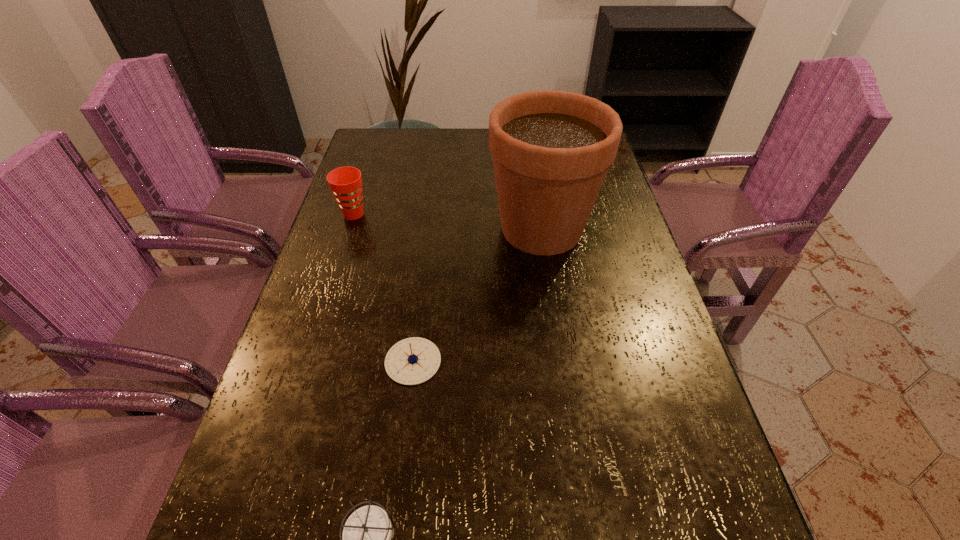
The image size is (960, 540). I want to click on vacant space at the far edge, so click(x=449, y=137).

In the image, there is a desktop. Identify the location of vacant space at the left edge. This screenshot has width=960, height=540. (399, 186).

Identify the location of vacant space at the right edge of the desktop. (618, 339).

This screenshot has width=960, height=540. Identify the location of vacant position at the far left corner of the desktop. (365, 150).

This screenshot has height=540, width=960. In order to click on vacant space that is in between the rightmost object and the farther compass in this screenshot , I will do `click(477, 295)`.

Locate an element on the screen. The width and height of the screenshot is (960, 540). free area in between the third shortest object and the flowerpot is located at coordinates (447, 221).

Identify which object is the closest to the rightmost object. Please provide its 2D coordinates. Your answer should be formatted as a tuple, i.e. [(x, y)], where the tuple contains the x and y coordinates of a point satisfying the conditions above.

[(411, 361)]

Identify the location of the second closest object to the shorter compass. This screenshot has width=960, height=540. (551, 150).

This screenshot has width=960, height=540. I want to click on the second closest compass to the flowerpot, so click(367, 533).